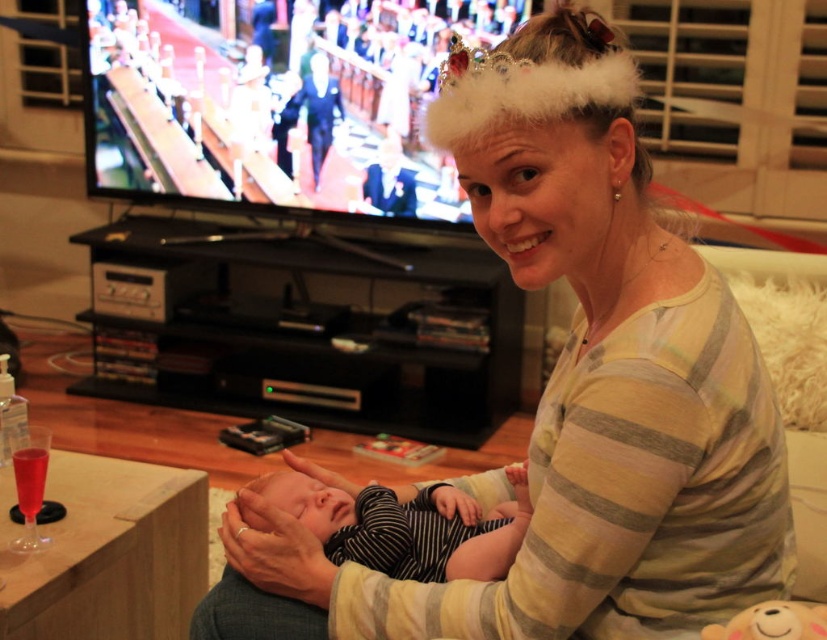
In the image, you see a woman wearing a striped cotton shirt at center and holding a baby in a black striped onesie at center. Which clothing item is located more to the right?

The striped cotton shirt at center is positioned on the right side of the black striped onesie at center, so it is more to the right.

You are a photographer trying to capture the baby in the black striped onesie at center. The camera you are using has a focus point at coordinates 0.823, 0.491. Will the focus point align with the baby?

The black striped onesie at center is located at point (405, 525), so yes, the focus point will align with the baby.